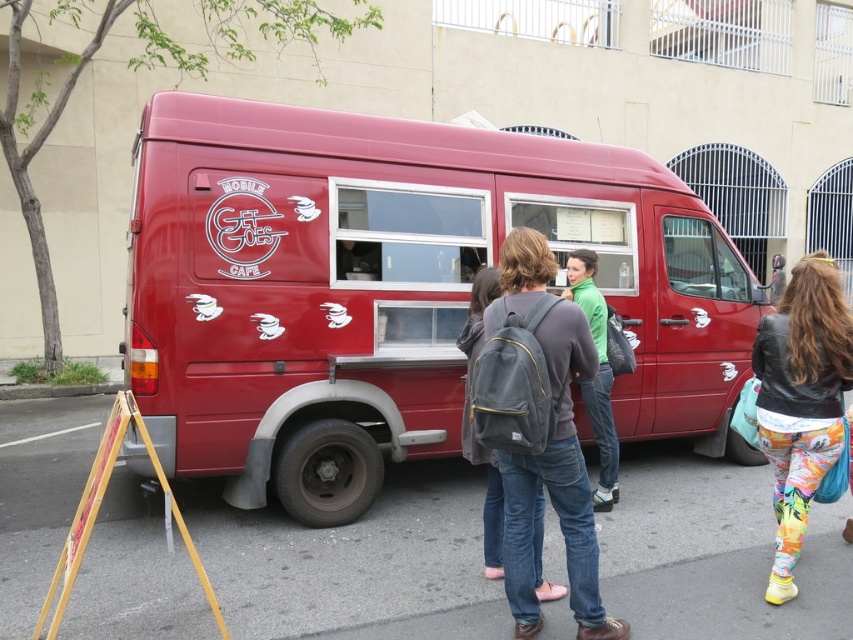
Can you confirm if denim jeans at center is positioned to the left of floral leggings at lower right?

Indeed, denim jeans at center is positioned on the left side of floral leggings at lower right.

Does point (547, 344) come behind point (824, 472)?

No, (547, 344) is in front of (824, 472).

This screenshot has width=853, height=640. What do you see at coordinates (538, 429) in the screenshot?
I see `denim jeans at center` at bounding box center [538, 429].

The image size is (853, 640). Find the location of `denim jeans at center`. denim jeans at center is located at coordinates (538, 429).

Does matte red van at center come in front of denim jeans at center?

No, it is behind denim jeans at center.

Is matte red van at center bigger than denim jeans at center?

Correct, matte red van at center is larger in size than denim jeans at center.

Measure the distance between matte red van at center and camera.

The distance of matte red van at center from camera is 14.03 feet.

At what (x,y) coordinates should I click in order to perform the action: click on matte red van at center. Please return your answer as a coordinate pair (x, y). This screenshot has width=853, height=640. Looking at the image, I should click on (392, 289).

Can you confirm if matte red van at center is smaller than floral leggings at lower right?

No, matte red van at center is not smaller than floral leggings at lower right.

Who is higher up, matte red van at center or floral leggings at lower right?

Positioned higher is matte red van at center.

Find the location of a particular element. This screenshot has width=853, height=640. matte red van at center is located at coordinates (392, 289).